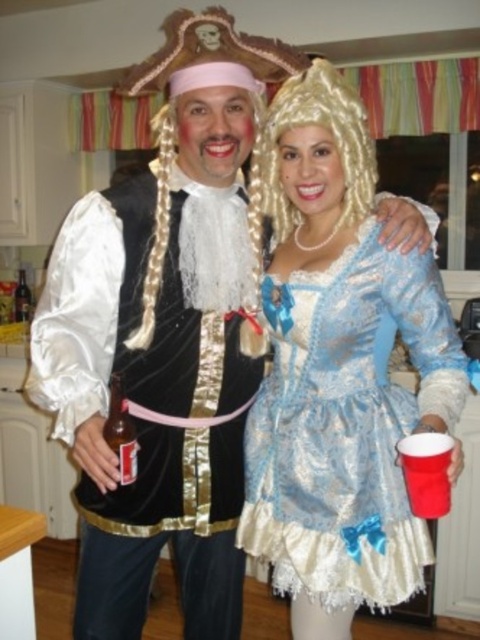
You are standing in a kitchen and need to reach a point marked at coordinates (x=282, y=513). The pirate and Alice in Wonderland characters are nearby. Can you safely walk to that point without getting too close to them?

The point at coordinates (x=282, y=513) is 1.35 meters away from you, so you can safely walk to that point without getting too close to the pirate and Alice in Wonderland characters.

You are a photographer setting up for a costume party photoshoot. You need to ensure that the shiny blue satin dress at center and the blonde synthetic wig at upper center are both visible in the frame. Based on their positions, which object is closer to the camera?

The blonde synthetic wig at upper center is closer to the camera because it is positioned above the shiny blue satin dress at center.

You are a photographer trying to capture the shiny blue satin dress at center in the image. Given that the camera is focused at point (347, 426), will the dress be in focus?

Yes, the shiny blue satin dress at center is located exactly at point (347, 426), so it will be in focus.